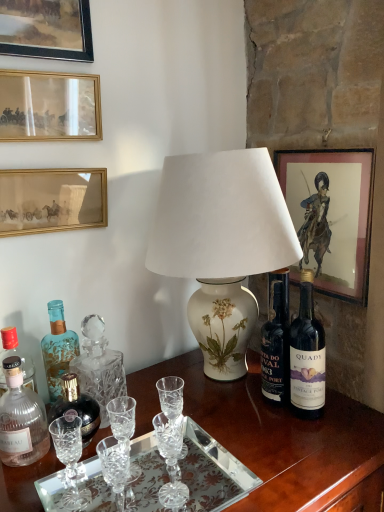
Locate an element on the screen. This screenshot has height=512, width=384. free space to the back side of matte glass bottle at center-left, arranged as the 2th bottle when viewed from the back is located at coordinates (102, 412).